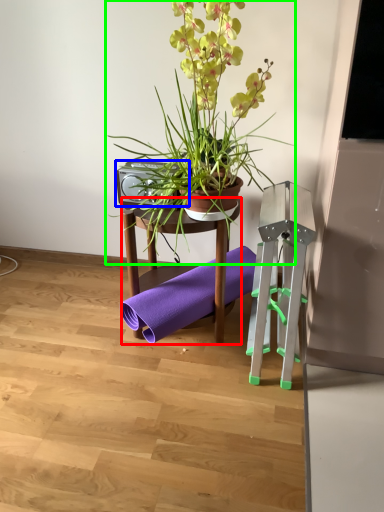
Question: Which object is the farthest from furniture (highlighted by a red box)? Choose among these: speaker (highlighted by a blue box) or houseplant (highlighted by a green box).

Choices:
 (A) speaker
 (B) houseplant

Answer: (B)